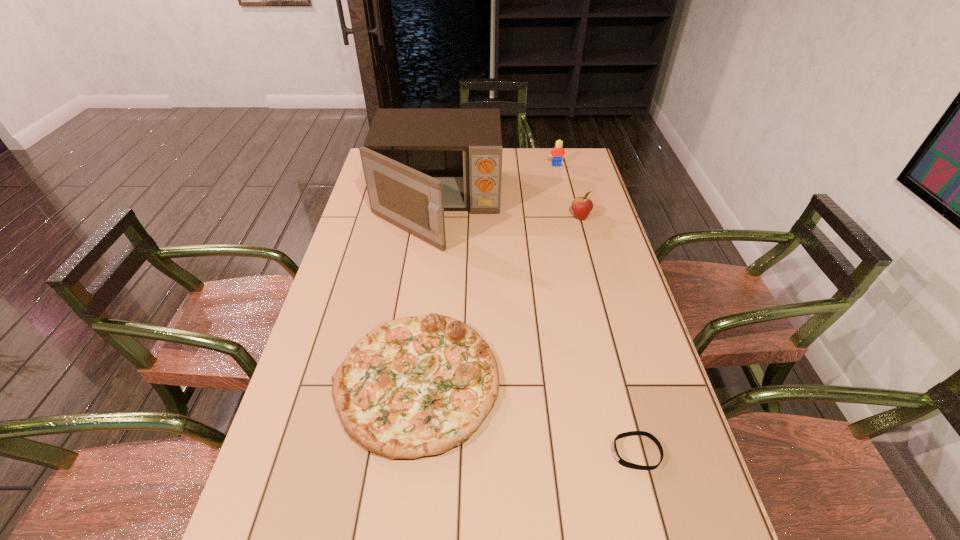
I want to click on vacant space positioned on the display of the shortest object, so click(x=537, y=453).

Image resolution: width=960 pixels, height=540 pixels. Identify the location of vacant space located on the display of the shortest object. (456, 453).

This screenshot has height=540, width=960. Find the location of `microwave oven that is at the far edge`. microwave oven that is at the far edge is located at coordinates (417, 163).

Locate an element on the screen. Lego that is at the far edge is located at coordinates (558, 152).

Identify the location of microwave oven located in the left edge section of the desktop. (417, 163).

Image resolution: width=960 pixels, height=540 pixels. Identify the location of pizza at the left edge. point(413,387).

This screenshot has width=960, height=540. I want to click on Lego present at the right edge, so [558, 152].

You are a GUI agent. You are given a task and a screenshot of the screen. Output one action in this format:
    pyautogui.click(x=<x>, y=<y>)
    Task: Click on the apple at the right edge
    
    Given the screenshot: What is the action you would take?
    pyautogui.click(x=581, y=206)

The image size is (960, 540). I want to click on wristband that is at the right edge, so click(622, 462).

You are a GUI agent. You are given a task and a screenshot of the screen. Output one action in this format:
    pyautogui.click(x=<x>, y=<y>)
    Task: Click on the object situated at the far left corner
    The image size is (960, 540).
    Given the screenshot: What is the action you would take?
    pyautogui.click(x=417, y=163)